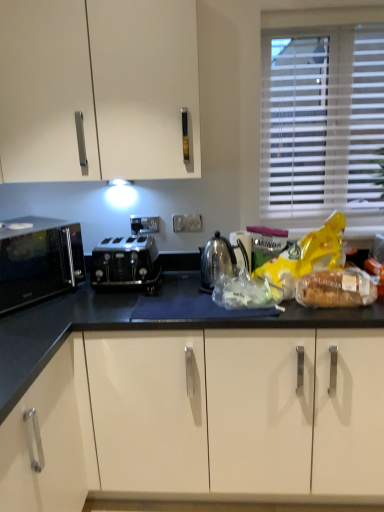
This screenshot has width=384, height=512. In order to click on vacant space underneath white blinds at upper right (from a real-world perspective) in this screenshot , I will do `click(321, 224)`.